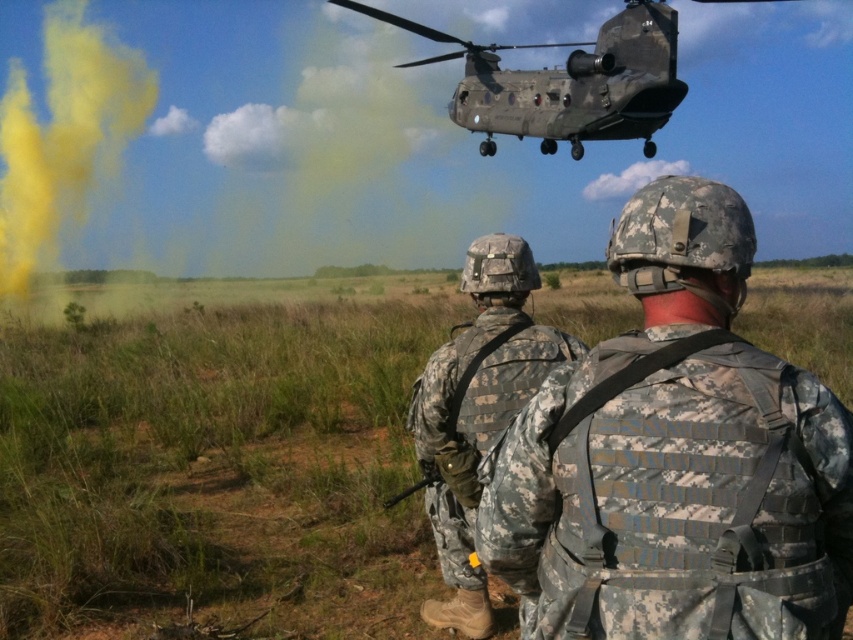
Question: Can you confirm if camouflage uniform at center is positioned above camouflage fabric uniform at center?

Choices:
 (A) no
 (B) yes

Answer: (B)

Question: Which point appears closest to the camera in this image?

Choices:
 (A) (502, 300)
 (B) (519, 109)

Answer: (A)

Question: Which object is the farthest from the camouflage paint helicopter at upper center?

Choices:
 (A) camouflage fabric vest at center
 (B) camouflage uniform at center

Answer: (A)

Question: Does camouflage fabric vest at center have a smaller size compared to camouflage paint helicopter at upper center?

Choices:
 (A) yes
 (B) no

Answer: (A)

Question: Which of the following is the closest to the observer?

Choices:
 (A) (550, 472)
 (B) (428, 410)
 (C) (196, 371)

Answer: (A)

Question: Observing the image, what is the correct spatial positioning of camouflage uniform at center in reference to camouflage paint helicopter at upper center?

Choices:
 (A) left
 (B) right

Answer: (A)